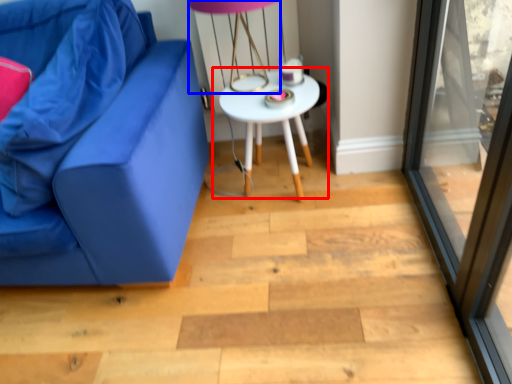
Question: Which object is further to the camera taking this photo, table (highlighted by a red box) or table lamp (highlighted by a blue box)?

Choices:
 (A) table
 (B) table lamp

Answer: (A)